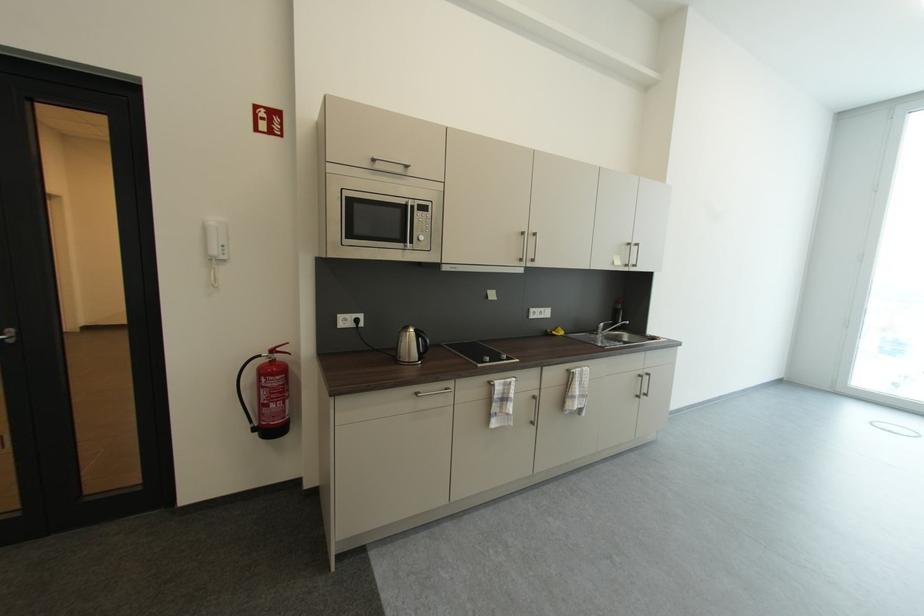
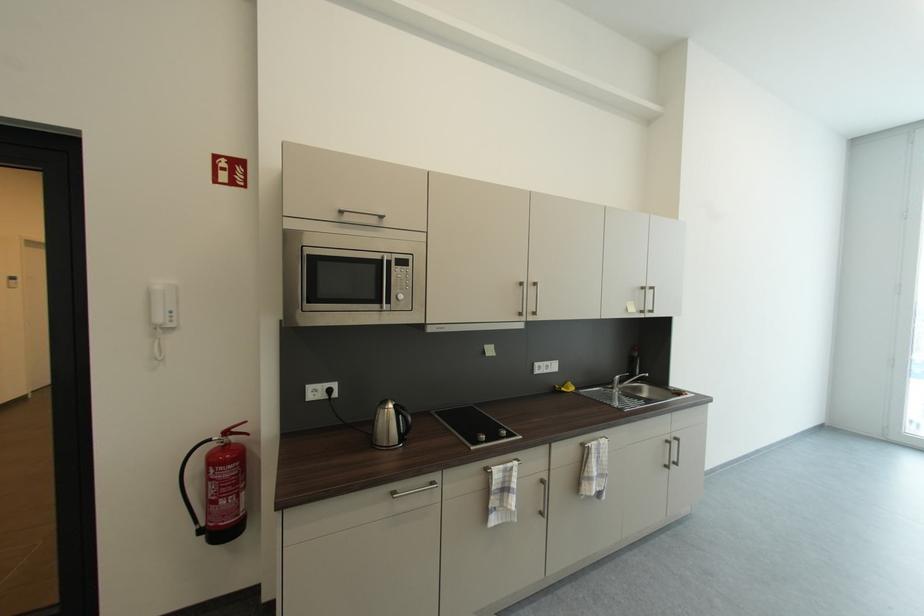
The point at (603, 330) is marked in the first image. Where is the corresponding point in the second image?

(618, 383)